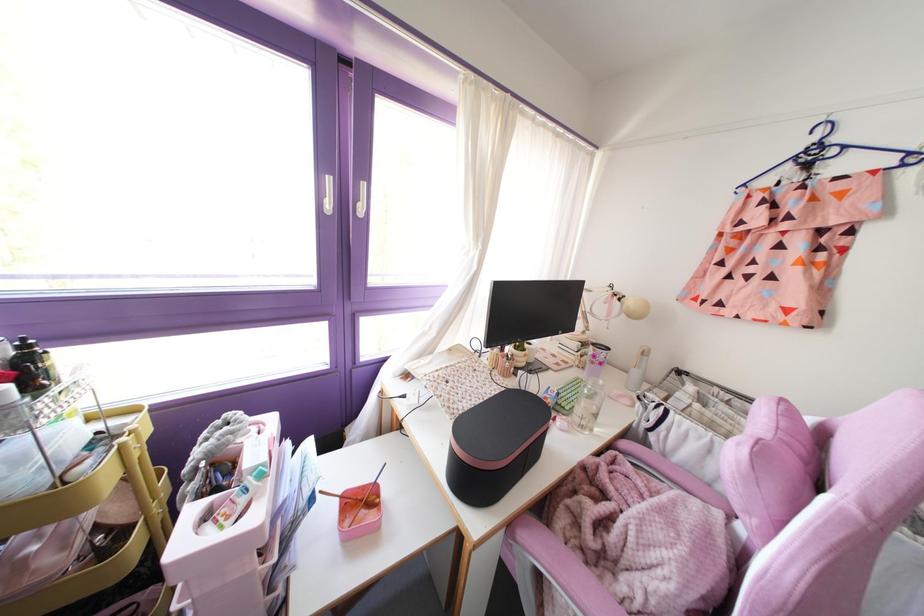
Where would you sit the chair sitting surface? Please return your answer as a coordinate pair (x, y).

(646, 541)